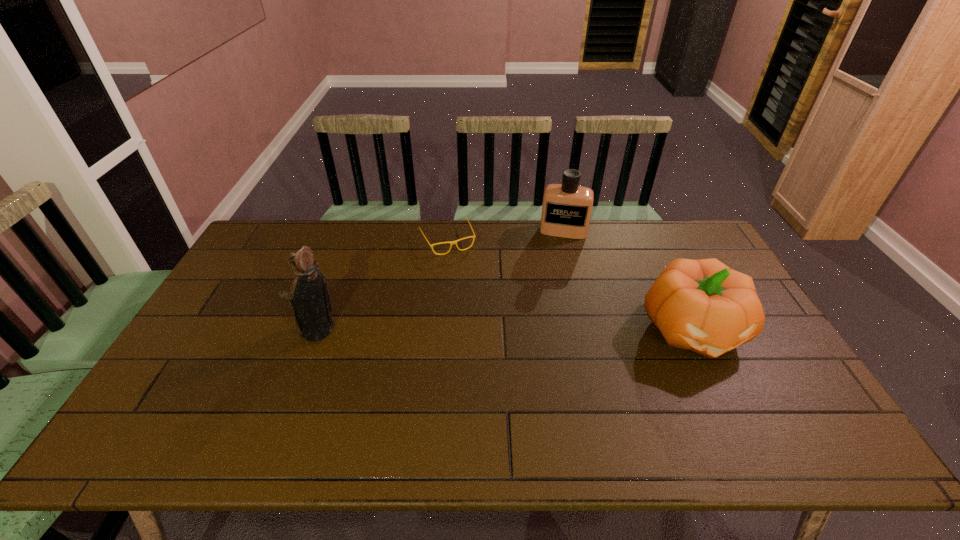
Identify the location of the tallest object. (309, 300).

Identify the location of figurine. (309, 300).

Locate an element on the screen. the rightmost object is located at coordinates [x=703, y=305].

Locate an element on the screen. This screenshot has height=540, width=960. the shortest object is located at coordinates (451, 242).

Find the location of a particular element. the second object from left to right is located at coordinates coord(451,242).

Where is `perfume`? Image resolution: width=960 pixels, height=540 pixels. perfume is located at coordinates (566, 210).

At what (x,y) coordinates should I click in order to perform the action: click on free space located 0.220m on the front-facing side of the tallest object. Please return your answer as a coordinate pair (x, y). Image resolution: width=960 pixels, height=540 pixels. Looking at the image, I should click on (220, 330).

Find the location of a particular element. free space located 0.090m on the front-facing side of the tallest object is located at coordinates (265, 330).

Identify the location of free space located on the front-facing side of the tallest object. This screenshot has width=960, height=540. click(269, 330).

Where is `free spot located 0.050m on the carved face of the rightmost object`? This screenshot has height=540, width=960. free spot located 0.050m on the carved face of the rightmost object is located at coordinates 721,387.